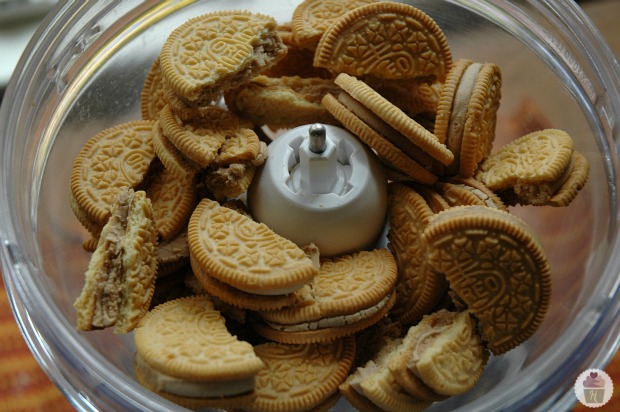
Where is `shinny wooden surface`? The image size is (620, 412). shinny wooden surface is located at coordinates (20, 367).